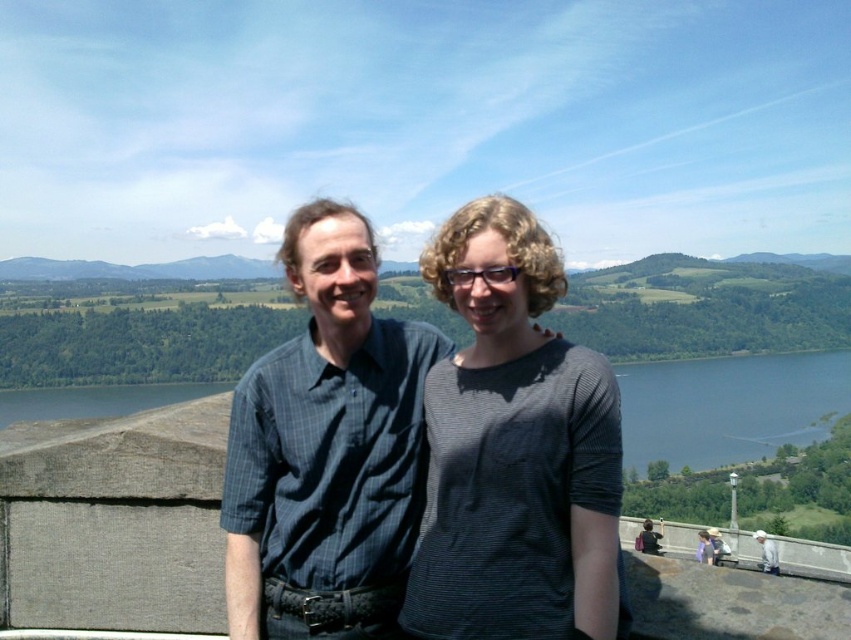
You are a photographer trying to capture a landscape shot of the blue water at lower right and the blue water at lower left. Which one would you focus on if you want to photograph the larger body of water?

The blue water at lower right is larger in size than the blue water at lower left, so you should focus on the blue water at lower right to photograph the larger body of water.

You are a photographer trying to focus on the dark gray striped shirt at center. What are the coordinates where you should adjust your camera focus to?

The coordinates to focus on are at point (513, 451).